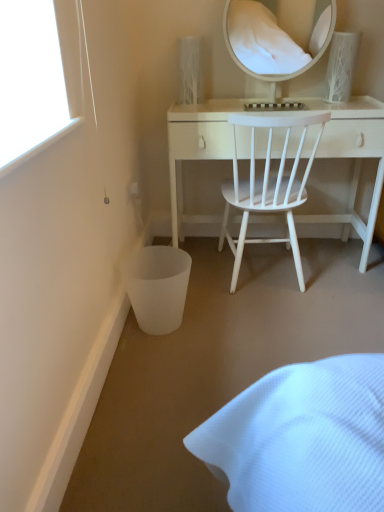
The height and width of the screenshot is (512, 384). Find the location of `unoccupied region to the right of white textured vase at upper right`. unoccupied region to the right of white textured vase at upper right is located at coordinates (368, 99).